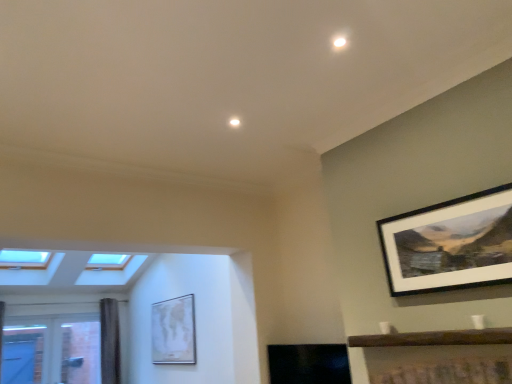
Question: Would you say wooden-framed print at upper right, the 1th picture frame in the top-to-bottom sequence, is inside or outside wooden shelf at lower right?

Choices:
 (A) outside
 (B) inside

Answer: (A)

Question: Considering the positions of wooden-framed print at upper right, the second picture frame viewed from the left, and wooden shelf at lower right in the image, is wooden-framed print at upper right, the second picture frame viewed from the left, wider or thinner than wooden shelf at lower right?

Choices:
 (A) wide
 (B) thin

Answer: (B)

Question: Estimate the real-world distances between objects in this image. Which object is farther from the clear glass window at lower left?

Choices:
 (A) wooden shelf at lower right
 (B) dark gray textured curtain at left
 (C) wooden-framed print at upper right, the 1th picture frame in the top-to-bottom sequence
 (D) matte white map at center, placed as the 1th picture frame when sorted from back to front

Answer: (C)

Question: Estimate the real-world distances between objects in this image. Which object is farther from the wooden-framed print at upper right, the 1th picture frame in the top-to-bottom sequence?

Choices:
 (A) dark gray textured curtain at left
 (B) wooden shelf at lower right
 (C) matte white map at center, positioned as the first picture frame in left-to-right order
 (D) clear glass window at lower left

Answer: (D)